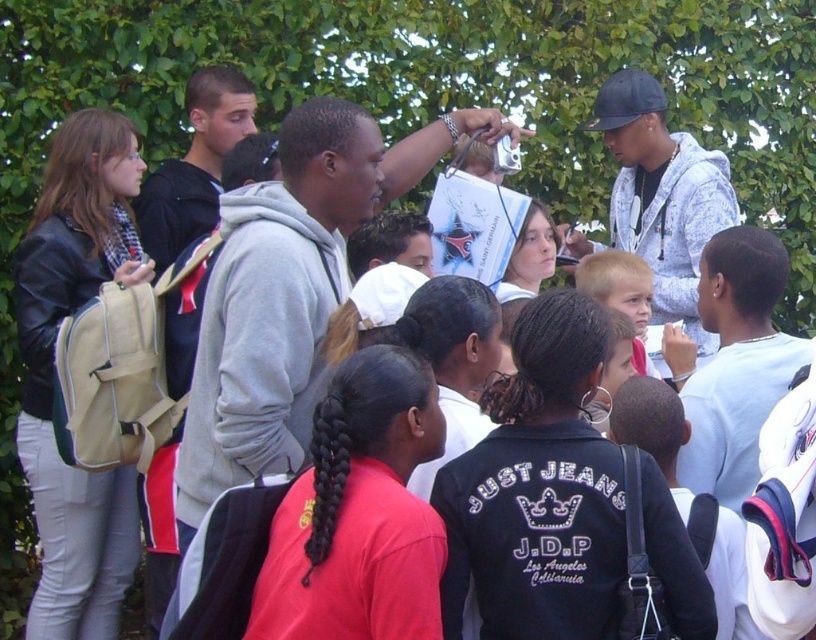
You are standing at the camera position and want to hand a small item to the person wearing the black leather jacket at center. Considering the distance, can you throw the item directly to them without moving from your current position?

The black leather jacket at center is 6.49 meters away from the camera. Throwing an item that distance might be challenging for most people, as typical throwing ranges for small items are around 5 meters or less. It would be safer to move closer or ask them to come nearer.

You are a photographer trying to capture a photo of both the black leather jacket at center and the leather jacket at left. Since you can only focus on one jacket at a time, which jacket should you focus on first if you want to include both in the frame without moving the camera?

You should focus on the leather jacket at left first because the black leather jacket at center is to the right of it, so by starting with the left jacket, you can ensure both are within the frame without needing to adjust the camera position.

You are a tailor who needs to determine which leather jacket between the black leather jacket at center and the leather jacket at left requires more fabric for alterations. Based on the scene, which one would need more fabric?

The black leather jacket at center requires more fabric for alterations because its width is larger than the leather jacket at left.